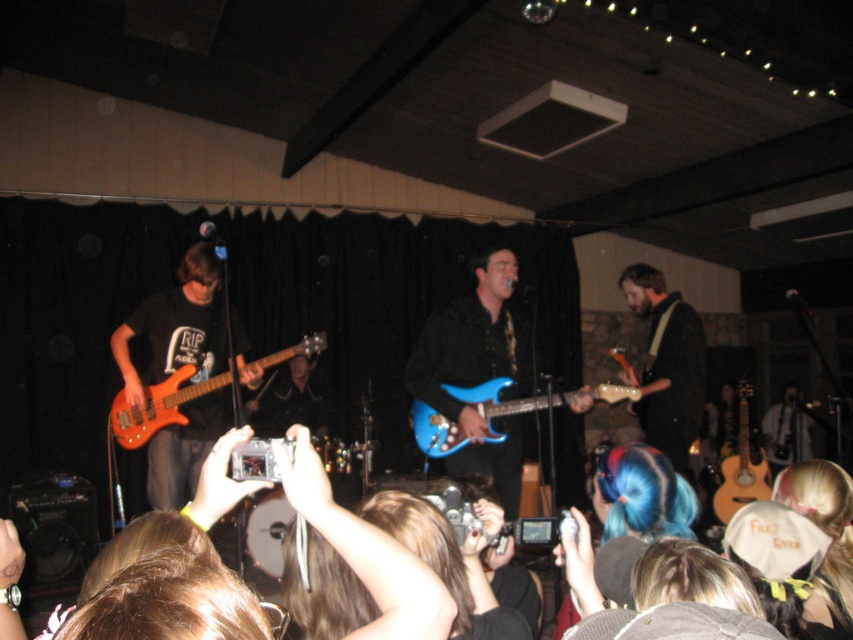
Who is more forward, (514,413) or (741,433)?

Point (514,413) is more forward.

Where is `blue glossy electric guitar at center`? The height and width of the screenshot is (640, 853). blue glossy electric guitar at center is located at coordinates coord(527,401).

You are a GUI agent. You are given a task and a screenshot of the screen. Output one action in this format:
    pyautogui.click(x=<x>, y=<y>)
    Task: Click on the blue glossy electric guitar at center
    The width and height of the screenshot is (853, 640).
    Given the screenshot: What is the action you would take?
    pyautogui.click(x=527, y=401)

Does matte orange bass guitar at left appear on the left side of acoustic wood guitar at right?

Indeed, matte orange bass guitar at left is positioned on the left side of acoustic wood guitar at right.

Locate an element on the screen. The image size is (853, 640). matte orange bass guitar at left is located at coordinates (160, 404).

Describe the element at coordinates (160, 404) in the screenshot. I see `matte orange bass guitar at left` at that location.

What are the coordinates of `matte orange bass guitar at left` in the screenshot? It's located at (160, 404).

Is blue glossy electric guitar at center behind matte orange bass guitar at left?

No, blue glossy electric guitar at center is closer to the viewer.

Is blue glossy electric guitar at center to the left of matte orange bass guitar at left from the viewer's perspective?

Incorrect, blue glossy electric guitar at center is not on the left side of matte orange bass guitar at left.

Find the location of a particular element. The height and width of the screenshot is (640, 853). blue glossy electric guitar at center is located at coordinates (527, 401).

Find the location of `blue glossy electric guitar at center`. blue glossy electric guitar at center is located at coordinates (527, 401).